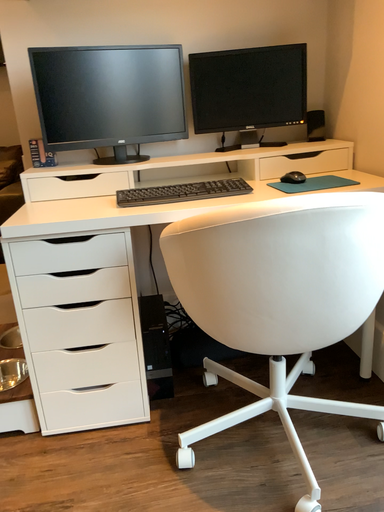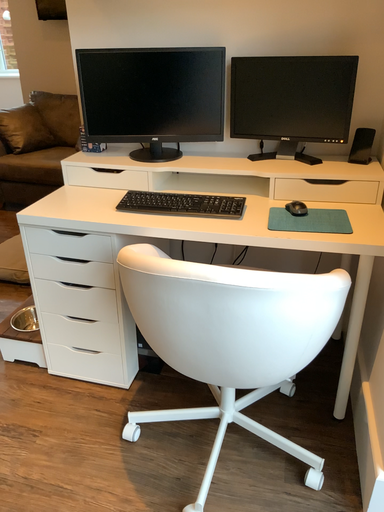
Question: Which way did the camera rotate in the video?

Choices:
 (A) rotated left
 (B) rotated right

Answer: (A)